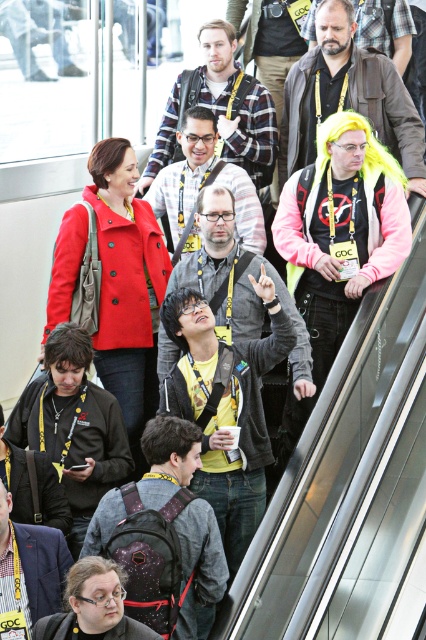
Question: Is shiny yellow wig at upper right bigger than plaid shirt at upper center?

Choices:
 (A) yes
 (B) no

Answer: (A)

Question: Does plaid shirt at upper center have a smaller size compared to matte gray hoodie at center?

Choices:
 (A) yes
 (B) no

Answer: (A)

Question: Is shiny yellow wig at upper right positioned in front of matte gray hoodie at center?

Choices:
 (A) yes
 (B) no

Answer: (A)

Question: Which object appears farthest from the camera in this image?

Choices:
 (A) plaid shirt at upper center
 (B) shiny yellow wig at upper right

Answer: (A)

Question: Considering the real-world distances, which object is farthest from the shiny yellow wig at upper right?

Choices:
 (A) matte gray hoodie at center
 (B) plaid shirt at upper center

Answer: (A)

Question: Which point is closer to the camera?

Choices:
 (A) (144, 177)
 (B) (339, 8)
 (C) (233, 172)

Answer: (B)